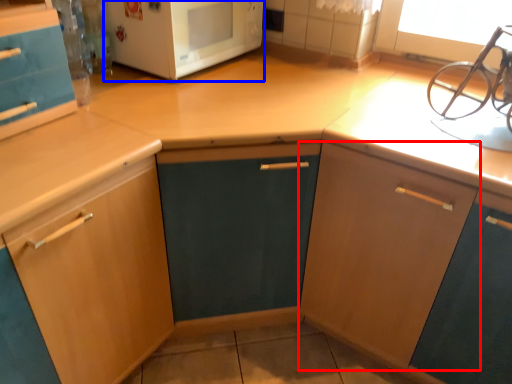
Question: Among these objects, which one is farthest to the camera, cabinetry (highlighted by a red box) or microwave oven (highlighted by a blue box)?

Choices:
 (A) cabinetry
 (B) microwave oven

Answer: (B)